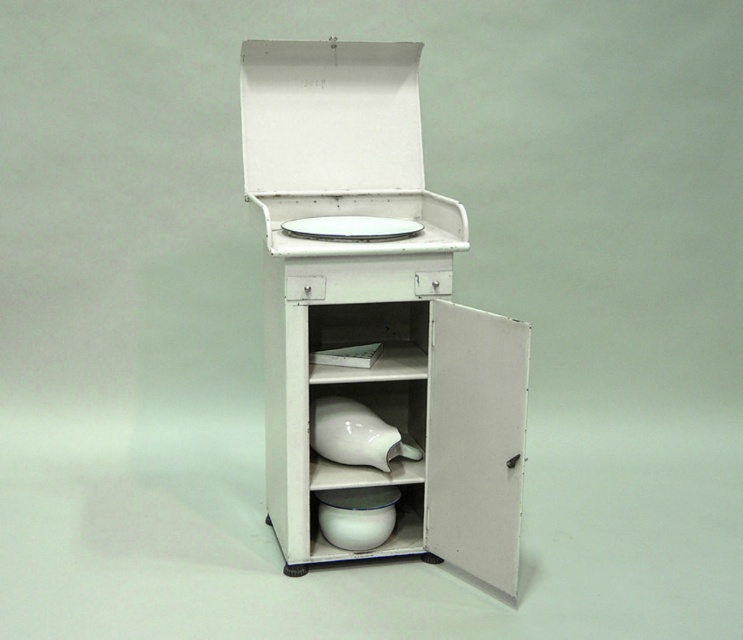
You are standing in front of the vintage kitchenette cabinet. There is a white glossy vase at center inside the cabinet. If you want to place a 7 feet long object behind the vase, will it fit? Please explain based on the distance between the vase and the camera.

The distance between the white glossy vase at center and the camera is 6.93 feet. Since the object is 7 feet long, it would extend beyond the available space behind the vase, so it won

You are organizing items in the vintage kitchenette cabinet. You have a white glossy vase at center and a white glossy plate at upper center. Where should you place the vase to maintain the current arrangement?

The white glossy vase at center is located below the white glossy plate at upper center, so to maintain the current arrangement, the vase should be placed below the plate.

You are organizing the items in the vintage kitchenette cabinet. You need to place a new decorative item between the white glossy vase at center and the white glossy plate at upper center. Where should you place it?

The white glossy vase at center is to the left of the white glossy plate at upper center, so you should place the new decorative item between them on the same shelf.